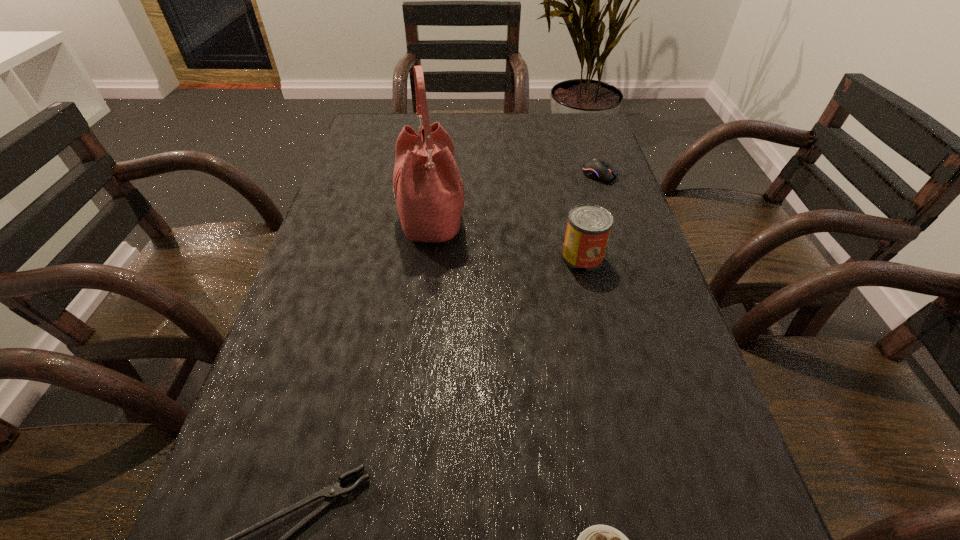
Locate an element on the screen. This screenshot has height=540, width=960. vacant region at the left edge of the desktop is located at coordinates (308, 416).

Locate an element on the screen. This screenshot has height=540, width=960. free space at the right edge of the desktop is located at coordinates 624,364.

The width and height of the screenshot is (960, 540). Identify the location of free spot at the far left corner of the desktop. (364, 118).

Identify the location of vacant area between the tallest object and the fourth shortest object. The image size is (960, 540). (507, 240).

Identify the location of vacant space that is in between the can and the tallest object. This screenshot has width=960, height=540. (507, 240).

You are a GUI agent. You are given a task and a screenshot of the screen. Output one action in this format:
    pyautogui.click(x=<x>, y=<y>)
    Task: Click on the object that is the second closest to the chocolate cake
    The image size is (960, 540).
    Given the screenshot: What is the action you would take?
    pyautogui.click(x=588, y=229)

The image size is (960, 540). I want to click on object that is the nearest to the third shortest object, so click(x=588, y=229).